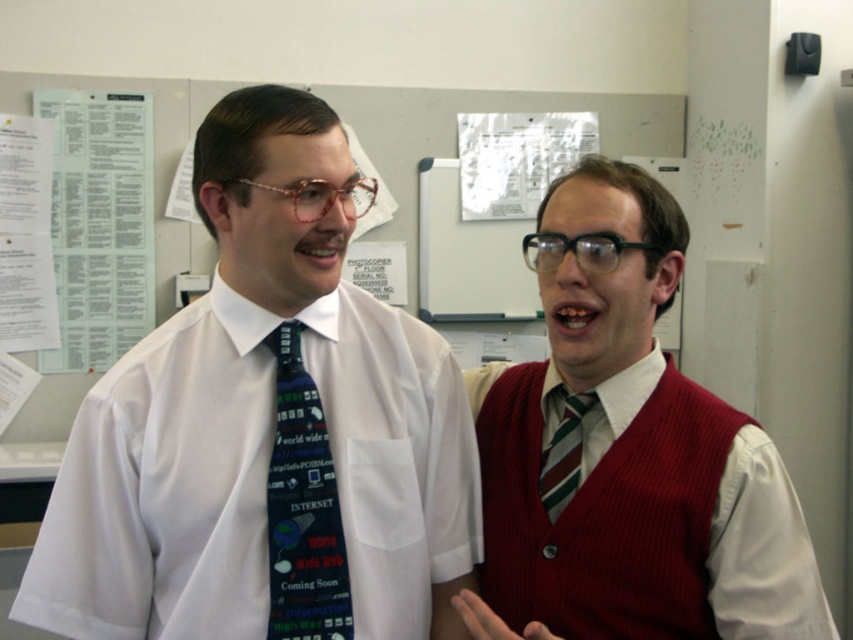
Question: Which of the following is the closest to the observer?

Choices:
 (A) striped fabric tie at center
 (B) white paper at upper left
 (C) ribbed red vest at center

Answer: (C)

Question: Can you confirm if white paper at upper left is positioned to the right of blue fabric tie at center?

Choices:
 (A) yes
 (B) no

Answer: (B)

Question: Does ribbed red vest at center appear on the left side of white paper at upper left?

Choices:
 (A) yes
 (B) no

Answer: (B)

Question: Among these objects, which one is nearest to the camera?

Choices:
 (A) knitted red vest at center
 (B) striped fabric tie at center
 (C) ribbed red vest at center

Answer: (C)

Question: Observing the image, what is the correct spatial positioning of knitted red vest at center in reference to white paper at upper left?

Choices:
 (A) below
 (B) above

Answer: (A)

Question: Which of these objects is positioned closest to the white paper at upper left?

Choices:
 (A) ribbed red vest at center
 (B) blue fabric tie at center
 (C) white shirt at center

Answer: (C)